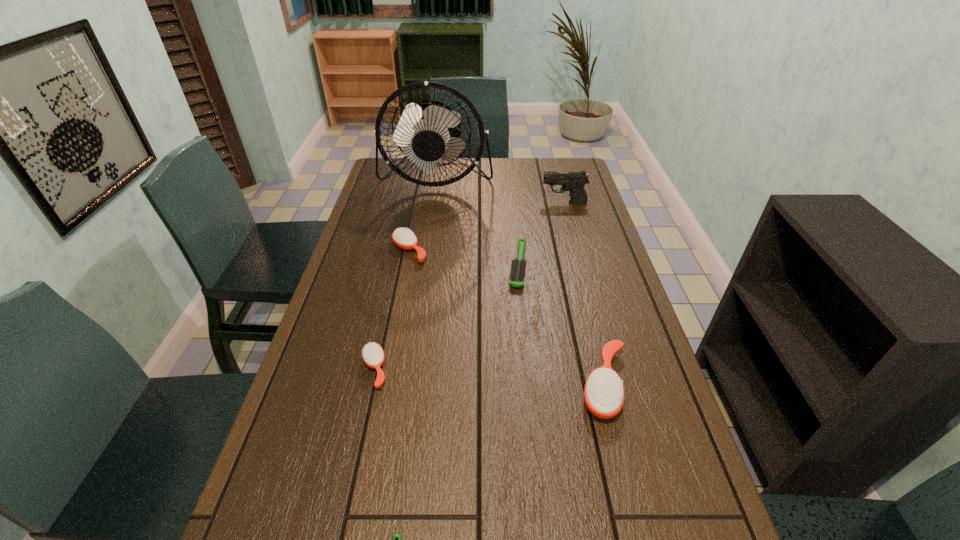
Image resolution: width=960 pixels, height=540 pixels. I want to click on fan positioned at the left edge, so click(x=426, y=132).

The width and height of the screenshot is (960, 540). Find the location of `pistol that is at the right edge`. pistol that is at the right edge is located at coordinates (574, 182).

Locate an element on the screen. Image resolution: width=960 pixels, height=540 pixels. hairbrush that is positioned at the right edge is located at coordinates (604, 392).

Where is `object present at the far left corner`? object present at the far left corner is located at coordinates [426, 132].

In the image, there is a desktop. Identify the location of vacant area at the far edge. This screenshot has width=960, height=540. (449, 172).

At what (x,y) coordinates should I click in order to perform the action: click on vacant space at the left edge of the desktop. Please return your answer as a coordinate pair (x, y). The image size is (960, 540). Looking at the image, I should click on (357, 224).

Locate an element on the screen. This screenshot has height=540, width=960. vacant space at the right edge of the desktop is located at coordinates pos(553,203).

Locate an element on the screen. vacant area at the far left corner of the desktop is located at coordinates (409, 165).

Where is `free space between the fifth shortest object and the bigger light hairbrush`? Image resolution: width=960 pixels, height=540 pixels. free space between the fifth shortest object and the bigger light hairbrush is located at coordinates (562, 325).

Locate an element on the screen. empty space that is in between the sixth nearest object and the second tallest hairbrush is located at coordinates (487, 227).